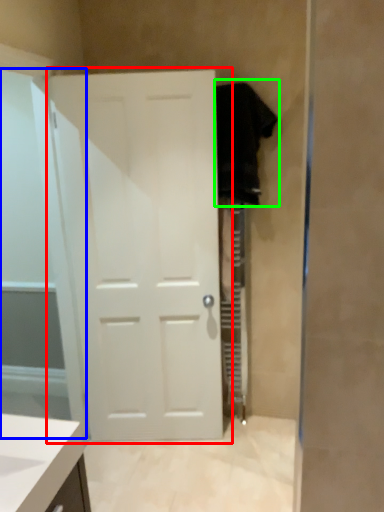
Question: Estimate the real-world distances between objects in this image. Which object is closer to door (highlighted by a red box), glass door (highlighted by a blue box) or robe (highlighted by a green box)?

Choices:
 (A) glass door
 (B) robe

Answer: (A)